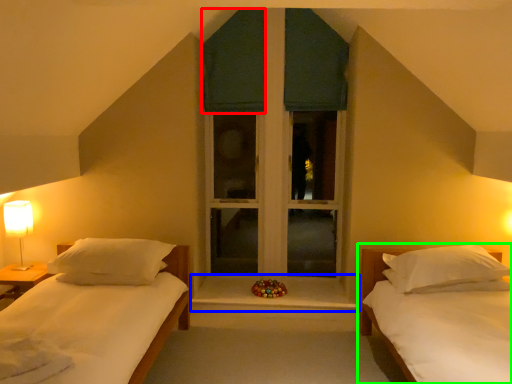
Question: Which is farther away from curtain (highlighted by a red box)? window sill (highlighted by a blue box) or bed (highlighted by a green box)?

Choices:
 (A) window sill
 (B) bed

Answer: (B)